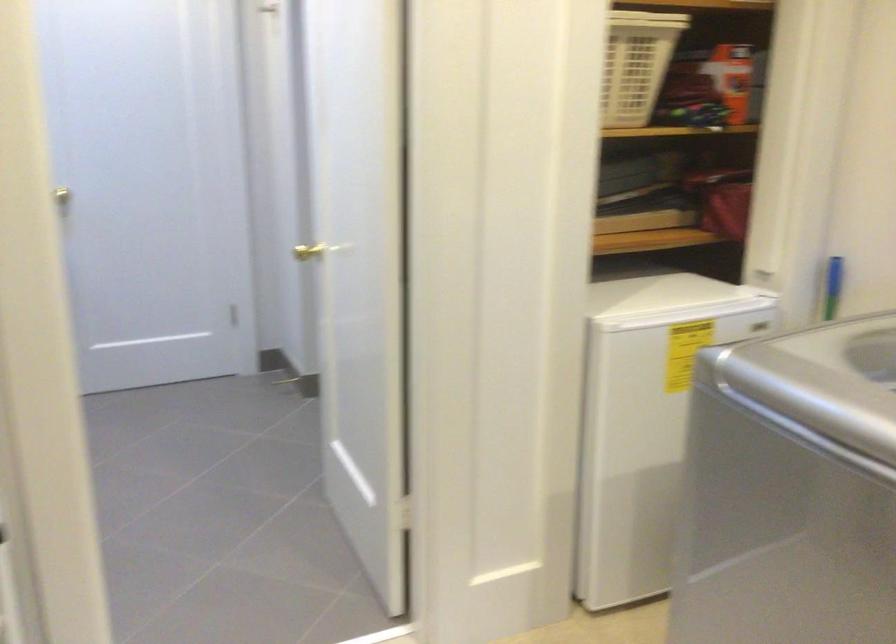
Where is `washing machine lid`? washing machine lid is located at coordinates (823, 380).